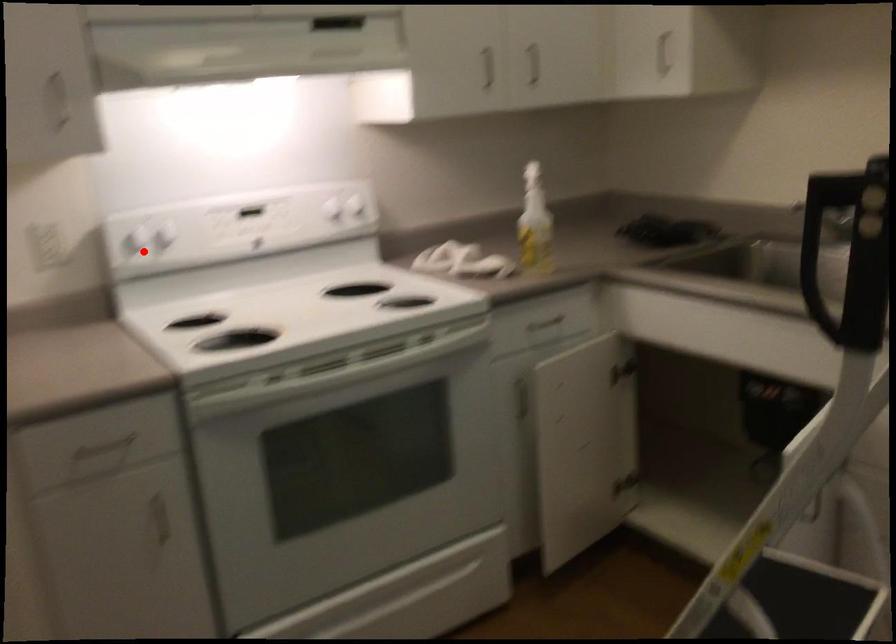
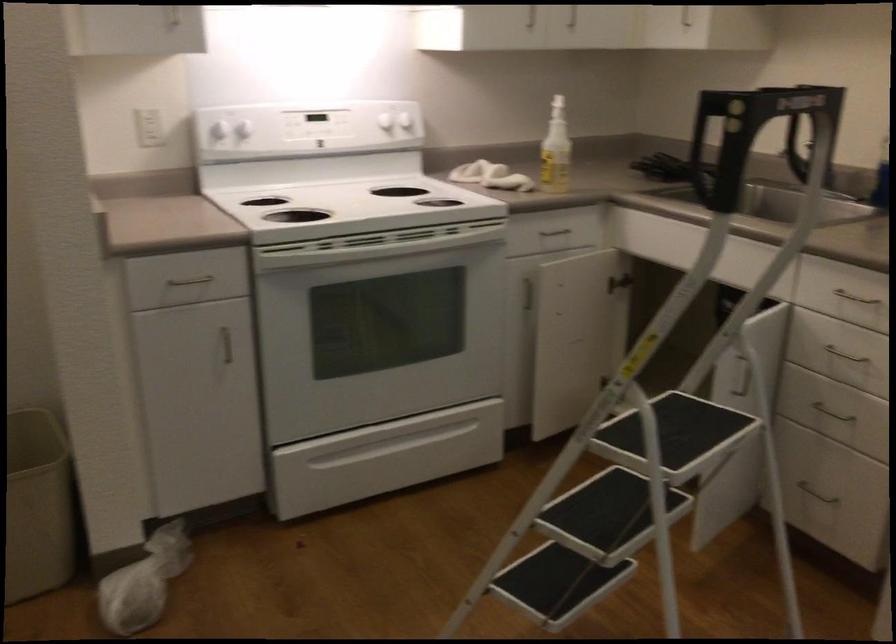
Question: I am providing you with two images of the same scene from different viewpoints. Image1 has a red point marked. In image2, the corresponding 3D location appears at what relative position? Reply with the corresponding letter.

Choices:
 (A) Closer
 (B) Farther

Answer: (B)